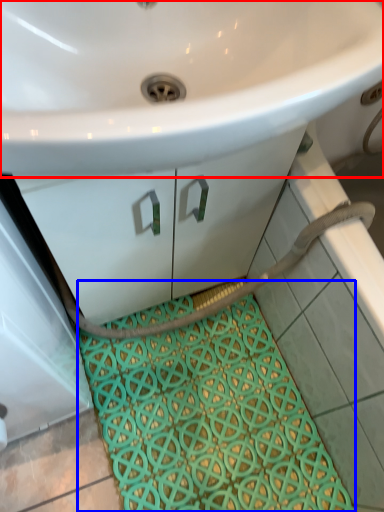
Question: Which of the following is the closest to the observer, sink (highlighted by a red box) or bath mat (highlighted by a blue box)?

Choices:
 (A) sink
 (B) bath mat

Answer: (A)